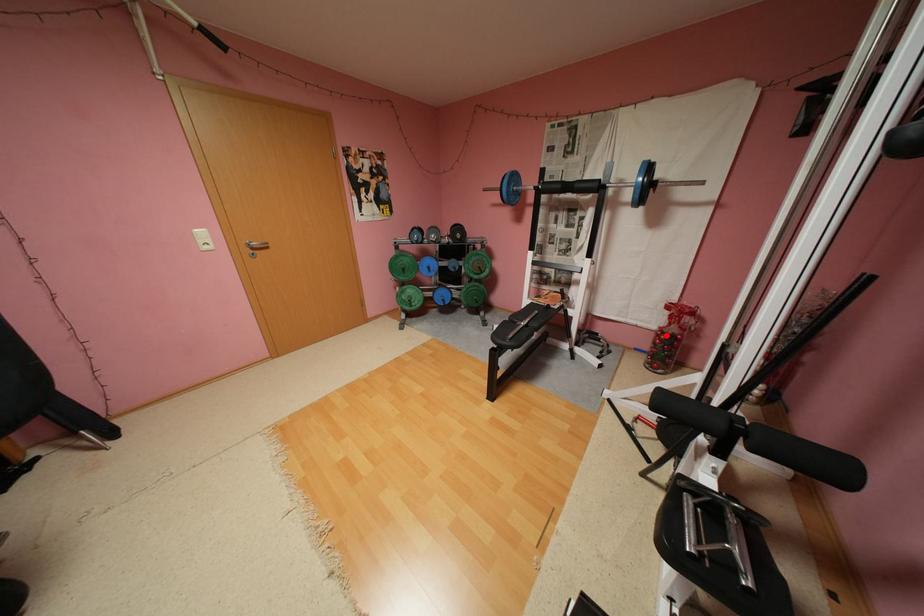
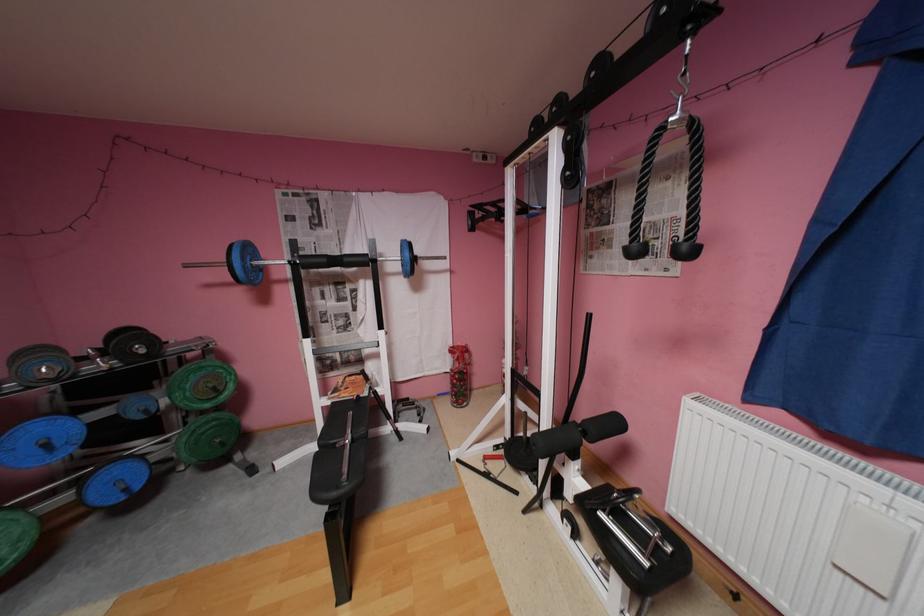
Locate, in the second image, the point that corresponds to the highlighted location in the first image.

(462, 377)